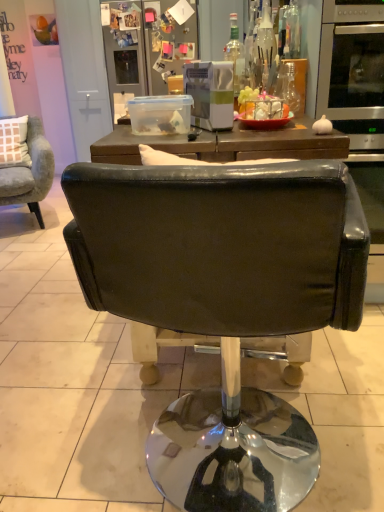
The width and height of the screenshot is (384, 512). What are the coordinates of `vacant space underneath black leather chair at center, which is counted as the 1th chair, starting from the front (from a real-world perspective)` in the screenshot? It's located at (190, 484).